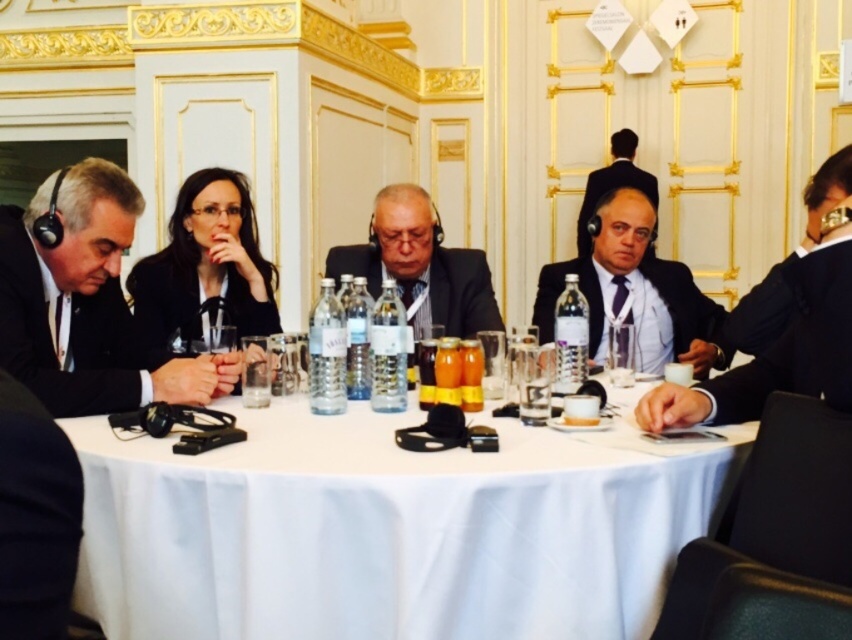
You are a guest at this formal meeting and need to choose a seat between the black matte suit at left and the black fabric suit at right. Which seat is closer to the center of the table?

The black matte suit at left is taller than the black fabric suit at right, but the question asks about proximity to the center of the table. The description provided does not mention the distance of either suit from the center, so it cannot be determined which seat is closer based on the given information.

You are standing at the point marked as point (131, 408) in a formal meeting room. You need to take a photo of the entire table setup. The camera you have can capture everything within a 2.31 meter radius from your current position. Will the camera be able to capture the entire table setup?

The point (131, 408) and camera are 2.31 meters apart from each other, so the camera can capture everything within a 2.31 meter radius. Therefore, the entire table setup will be within the camera range and can be captured.

You are a photographer setting up for a group photo. You need to ensure that all seated individuals are visible in the frame. Given the black fabric suit at right and the matte black suit at center, which person should be seated closer to the camera to avoid being blocked by the other?

The black fabric suit at right is much taller than the matte black suit at center, so the matte black suit at center should be seated closer to the camera to avoid being blocked by the taller individual at the right.